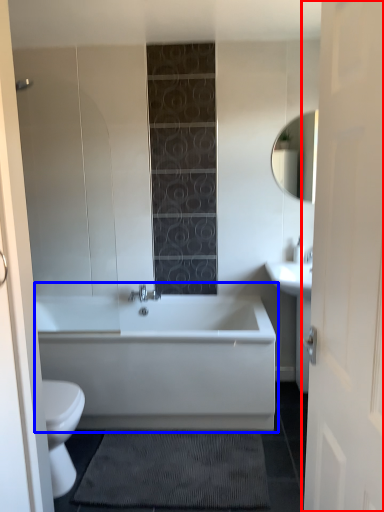
Question: Which point is closer to the camera, door (highlighted by a red box) or bathtub (highlighted by a blue box)?

Choices:
 (A) door
 (B) bathtub

Answer: (A)